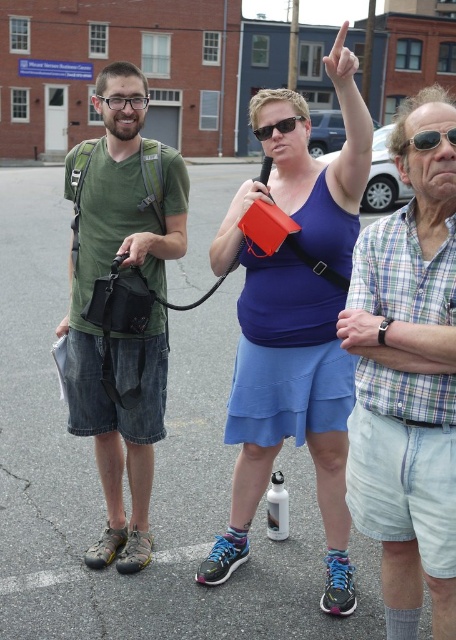
Question: Is the position of matte blue tank top at center less distant than that of clear plastic glasses at center?

Choices:
 (A) no
 (B) yes

Answer: (B)

Question: Among these objects, which one is farthest from the camera?

Choices:
 (A) plaid cotton shirt at center-right
 (B) clear plastic glasses at center

Answer: (B)

Question: Does plaid cotton shirt at center-right have a greater width compared to green matte t-shirt at left?

Choices:
 (A) no
 (B) yes

Answer: (A)

Question: Considering the real-world distances, which object is farthest from the white matte finger at upper center?

Choices:
 (A) clear plastic glasses at center
 (B) sunglasses at upper right
 (C) green matte t-shirt at left

Answer: (C)

Question: Estimate the real-world distances between objects in this image. Which object is closer to the sunglasses at upper right?

Choices:
 (A) matte black bag at left
 (B) matte black camera at center-left
 (C) matte blue tank top at center

Answer: (C)

Question: Does white matte finger at upper center appear on the right side of sunglasses at upper right?

Choices:
 (A) yes
 (B) no

Answer: (A)